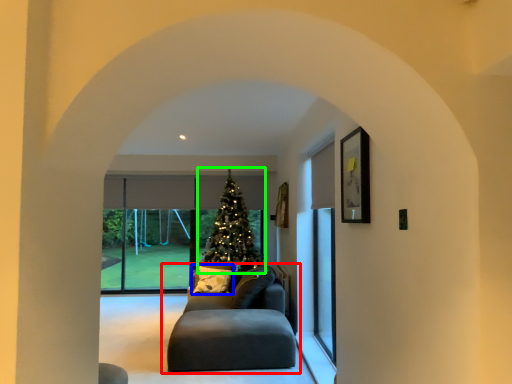
Question: Which is farther away from studio couch (highlighted by a red box)? pillow (highlighted by a blue box) or christmas tree (highlighted by a green box)?

Choices:
 (A) pillow
 (B) christmas tree

Answer: (B)